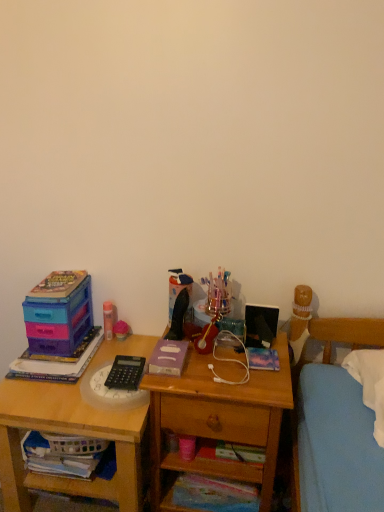
The image size is (384, 512). Identify the location of blank space above wooden nightstand at center (from a real-world perspective). (220, 358).